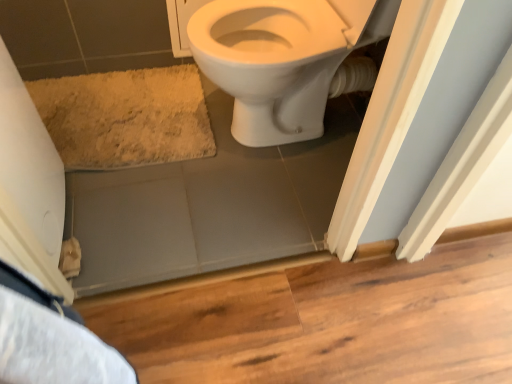
Question: From their relative heights in the image, would you say beige shaggy bath mat at lower left is taller or shorter than white glossy toilet at upper center?

Choices:
 (A) tall
 (B) short

Answer: (B)

Question: Looking at their shapes, would you say beige shaggy bath mat at lower left is wider or thinner than white glossy toilet at upper center?

Choices:
 (A) wide
 (B) thin

Answer: (B)

Question: Considering the positions of point (142, 137) and point (285, 117), is point (142, 137) closer or farther from the camera than point (285, 117)?

Choices:
 (A) closer
 (B) farther

Answer: (A)

Question: Considering their positions, is white glossy toilet at upper center located in front of or behind beige shaggy bath mat at lower left?

Choices:
 (A) behind
 (B) front

Answer: (B)

Question: Is white glossy toilet at upper center bigger or smaller than beige shaggy bath mat at lower left?

Choices:
 (A) big
 (B) small

Answer: (A)

Question: Is white glossy toilet at upper center inside or outside of beige shaggy bath mat at lower left?

Choices:
 (A) inside
 (B) outside

Answer: (B)

Question: From the image's perspective, is white glossy toilet at upper center positioned above or below beige shaggy bath mat at lower left?

Choices:
 (A) above
 (B) below

Answer: (A)